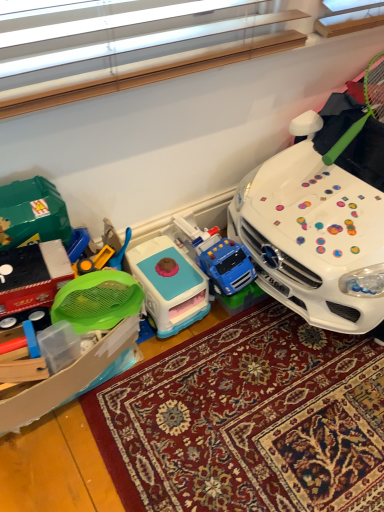
Locate an element on the screen. The height and width of the screenshot is (512, 384). white glossy car at right, marked as the 1th toy in a right-to-left arrangement is located at coordinates (322, 216).

The image size is (384, 512). Describe the element at coordinates (169, 285) in the screenshot. I see `blue plastic play kitchen at center, which is the second toy in right-to-left order` at that location.

What do you see at coordinates (62, 333) in the screenshot? I see `green mesh strainer at left, which is the first toy from left to right` at bounding box center [62, 333].

Find the location of a particular element. white glossy car at right, marked as the 1th toy in a right-to-left arrangement is located at coordinates (322, 216).

In the scene shown: Can you confirm if carpeted rug at center is positioned to the left of white glossy car at right, which appears as the third toy when viewed from the left?

Yes.

How many degrees apart are the facing directions of carpeted rug at center and white glossy car at right, marked as the 1th toy in a right-to-left arrangement?

2.34 degrees.

Which is nearer, (257, 463) or (274, 269)?

The point (257, 463) is in front.

In terms of width, does carpeted rug at center look wider or thinner when compared to white glossy car at right, which appears as the third toy when viewed from the left?

carpeted rug at center is wider than white glossy car at right, which appears as the third toy when viewed from the left.

Considering the positions of objects blue plastic play kitchen at center, which is the second toy in right-to-left order, and white glossy car at right, marked as the 1th toy in a right-to-left arrangement, in the image provided, who is more to the right, blue plastic play kitchen at center, which is the second toy in right-to-left order, or white glossy car at right, marked as the 1th toy in a right-to-left arrangement,?

white glossy car at right, marked as the 1th toy in a right-to-left arrangement.

From the image's perspective, does blue plastic play kitchen at center, which is the second toy in right-to-left order, appear lower than white glossy car at right, which appears as the third toy when viewed from the left?

Yes.

Is point (166, 267) farther from camera compared to point (375, 184)?

No.

Is white glossy car at right, marked as the 1th toy in a right-to-left arrangement, aimed at green mesh strainer at left, which is the first toy from left to right?

No, white glossy car at right, marked as the 1th toy in a right-to-left arrangement, is not oriented towards green mesh strainer at left, which is the first toy from left to right.

Identify the location of toy that is the 1st one when counting backward from the white glossy car at right, which appears as the third toy when viewed from the left. The width and height of the screenshot is (384, 512). (62, 333).

How different are the orientations of white glossy car at right, which appears as the third toy when viewed from the left, and green mesh strainer at left, which is the first toy from left to right, in degrees?

The facing directions of white glossy car at right, which appears as the third toy when viewed from the left, and green mesh strainer at left, which is the first toy from left to right, are 0.00196 degrees apart.

Considering the sizes of white glossy car at right, which appears as the third toy when viewed from the left, and green mesh strainer at left, which is the first toy from left to right, in the image, is white glossy car at right, which appears as the third toy when viewed from the left, taller or shorter than green mesh strainer at left, which is the first toy from left to right,?

Clearly, white glossy car at right, which appears as the third toy when viewed from the left, is taller compared to green mesh strainer at left, which is the first toy from left to right.

What's the angular difference between white glossy car at right, which appears as the third toy when viewed from the left, and blue plastic play kitchen at center, arranged as the 2th toy when viewed from the left,'s facing directions?

white glossy car at right, which appears as the third toy when viewed from the left, and blue plastic play kitchen at center, arranged as the 2th toy when viewed from the left, are facing 0.003 degrees away from each other.

Is white glossy car at right, which appears as the third toy when viewed from the left, facing away from blue plastic play kitchen at center, arranged as the 2th toy when viewed from the left?

No, white glossy car at right, which appears as the third toy when viewed from the left, is not facing away from blue plastic play kitchen at center, arranged as the 2th toy when viewed from the left.

Considering the positions of objects white glossy car at right, which appears as the third toy when viewed from the left, and blue plastic play kitchen at center, which is the second toy in right-to-left order, in the image provided, who is more to the left, white glossy car at right, which appears as the third toy when viewed from the left, or blue plastic play kitchen at center, which is the second toy in right-to-left order,?

blue plastic play kitchen at center, which is the second toy in right-to-left order, is more to the left.

From the picture: Considering the sizes of objects white glossy car at right, which appears as the third toy when viewed from the left, and blue plastic play kitchen at center, arranged as the 2th toy when viewed from the left, in the image provided, who is taller, white glossy car at right, which appears as the third toy when viewed from the left, or blue plastic play kitchen at center, arranged as the 2th toy when viewed from the left,?

With more height is white glossy car at right, which appears as the third toy when viewed from the left.

Is white glossy car at right, marked as the 1th toy in a right-to-left arrangement, positioned with its back to carpeted rug at center?

No.

Can we say white glossy car at right, which appears as the third toy when viewed from the left, lies outside carpeted rug at center?

Yes, white glossy car at right, which appears as the third toy when viewed from the left, is not within carpeted rug at center.

Which of these two, white glossy car at right, marked as the 1th toy in a right-to-left arrangement, or carpeted rug at center, is thinner?

With smaller width is white glossy car at right, marked as the 1th toy in a right-to-left arrangement.

Which of these two, green mesh strainer at left, the third toy when ordered from right to left, or white glossy car at right, marked as the 1th toy in a right-to-left arrangement, stands taller?

Standing taller between the two is white glossy car at right, marked as the 1th toy in a right-to-left arrangement.

The width and height of the screenshot is (384, 512). I want to click on toy above the green mesh strainer at left, which is the first toy from left to right (from a real-world perspective), so click(x=322, y=216).

Is green mesh strainer at left, the third toy when ordered from right to left, looking in the opposite direction of white glossy car at right, marked as the 1th toy in a right-to-left arrangement?

green mesh strainer at left, the third toy when ordered from right to left, does not have its back to white glossy car at right, marked as the 1th toy in a right-to-left arrangement.

Measure the distance from green mesh strainer at left, which is the first toy from left to right, to carpeted rug at center.

They are 11.49 inches apart.

What's the angular difference between green mesh strainer at left, which is the first toy from left to right, and carpeted rug at center's facing directions?

The angular difference between green mesh strainer at left, which is the first toy from left to right, and carpeted rug at center is 2.34 degrees.

Which of these two, green mesh strainer at left, the third toy when ordered from right to left, or carpeted rug at center, stands shorter?

Standing shorter between the two is carpeted rug at center.

Is green mesh strainer at left, which is the first toy from left to right, oriented away from carpeted rug at center?

No, carpeted rug at center is not at the back of green mesh strainer at left, which is the first toy from left to right.

From a real-world perspective, count 3rd toys upward from the carpeted rug at center and point to it. Please provide its 2D coordinates.

[(322, 216)]

At what (x,y) coordinates should I click in order to perform the action: click on the 1st toy to the left of the white glossy car at right, which appears as the third toy when viewed from the left, counting from the anchor's position. Please return your answer as a coordinate pair (x, y). The height and width of the screenshot is (512, 384). Looking at the image, I should click on (169, 285).

Considering their positions, is white glossy car at right, marked as the 1th toy in a right-to-left arrangement, positioned further to blue plastic play kitchen at center, which is the second toy in right-to-left order, than carpeted rug at center?

white glossy car at right, marked as the 1th toy in a right-to-left arrangement, is further to blue plastic play kitchen at center, which is the second toy in right-to-left order.

When comparing their distances from green mesh strainer at left, the third toy when ordered from right to left, does carpeted rug at center or blue plastic play kitchen at center, arranged as the 2th toy when viewed from the left, seem further?

Based on the image, carpeted rug at center appears to be further to green mesh strainer at left, the third toy when ordered from right to left.

Which object lies nearer to the anchor point white glossy car at right, marked as the 1th toy in a right-to-left arrangement, green mesh strainer at left, the third toy when ordered from right to left, or carpeted rug at center?

carpeted rug at center is closer to white glossy car at right, marked as the 1th toy in a right-to-left arrangement.

Considering their positions, is blue plastic play kitchen at center, arranged as the 2th toy when viewed from the left, positioned further to green mesh strainer at left, which is the first toy from left to right, than white glossy car at right, marked as the 1th toy in a right-to-left arrangement?

white glossy car at right, marked as the 1th toy in a right-to-left arrangement, is further to green mesh strainer at left, which is the first toy from left to right.

When comparing their distances from blue plastic play kitchen at center, which is the second toy in right-to-left order, does white glossy car at right, which appears as the third toy when viewed from the left, or green mesh strainer at left, the third toy when ordered from right to left, seem further?

Based on the image, white glossy car at right, which appears as the third toy when viewed from the left, appears to be further to blue plastic play kitchen at center, which is the second toy in right-to-left order.

Based on the photo, when comparing their distances from carpeted rug at center, does blue plastic play kitchen at center, arranged as the 2th toy when viewed from the left, or white glossy car at right, which appears as the third toy when viewed from the left, seem further?

white glossy car at right, which appears as the third toy when viewed from the left, lies further to carpeted rug at center than the other object.

Considering their positions, is green mesh strainer at left, which is the first toy from left to right, positioned further to carpeted rug at center than white glossy car at right, which appears as the third toy when viewed from the left?

Among the two, white glossy car at right, which appears as the third toy when viewed from the left, is located further to carpeted rug at center.

When comparing their distances from green mesh strainer at left, the third toy when ordered from right to left, does white glossy car at right, marked as the 1th toy in a right-to-left arrangement, or blue plastic play kitchen at center, which is the second toy in right-to-left order, seem further?

white glossy car at right, marked as the 1th toy in a right-to-left arrangement, is positioned further to the anchor green mesh strainer at left, the third toy when ordered from right to left.

You are a GUI agent. You are given a task and a screenshot of the screen. Output one action in this format:
    pyautogui.click(x=<x>, y=<y>)
    Task: Click on the mat between green mesh strainer at left, the third toy when ordered from right to left, and blue plastic play kitchen at center, which is the second toy in right-to-left order, along the z-axis
    Image resolution: width=384 pixels, height=512 pixels.
    Given the screenshot: What is the action you would take?
    pyautogui.click(x=248, y=420)

Where is `mat located between blue plastic play kitchen at center, arranged as the 2th toy when viewed from the left, and white glossy car at right, marked as the 1th toy in a right-to-left arrangement, in the left-right direction`? The image size is (384, 512). mat located between blue plastic play kitchen at center, arranged as the 2th toy when viewed from the left, and white glossy car at right, marked as the 1th toy in a right-to-left arrangement, in the left-right direction is located at coordinates (248, 420).

I want to click on mat situated between green mesh strainer at left, the third toy when ordered from right to left, and white glossy car at right, which appears as the third toy when viewed from the left, from left to right, so click(x=248, y=420).

Where is `toy between green mesh strainer at left, which is the first toy from left to right, and white glossy car at right, which appears as the third toy when viewed from the left`? toy between green mesh strainer at left, which is the first toy from left to right, and white glossy car at right, which appears as the third toy when viewed from the left is located at coordinates (169, 285).